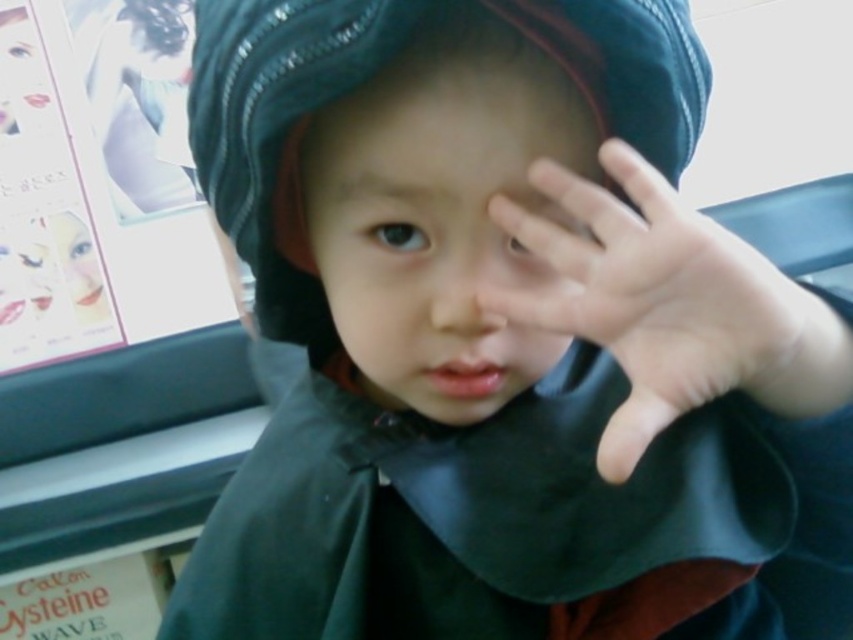
Question: Which of the following is the closest to the observer?

Choices:
 (A) smooth skin hand at upper right
 (B) smooth skin face at center
 (C) denim hat at center

Answer: (A)

Question: Which object is positioned farthest from the smooth skin hand at upper right?

Choices:
 (A) smooth skin face at center
 (B) denim hat at center

Answer: (B)

Question: Which of the following is the farthest from the observer?

Choices:
 (A) (544, 60)
 (B) (596, 456)
 (C) (656, 164)

Answer: (B)

Question: Is denim hat at center thinner than smooth skin hand at upper right?

Choices:
 (A) yes
 (B) no

Answer: (B)

Question: Does smooth skin face at center appear over smooth skin hand at upper right?

Choices:
 (A) no
 (B) yes

Answer: (B)

Question: Observing the image, what is the correct spatial positioning of smooth skin face at center in reference to denim hat at center?

Choices:
 (A) left
 (B) right

Answer: (B)